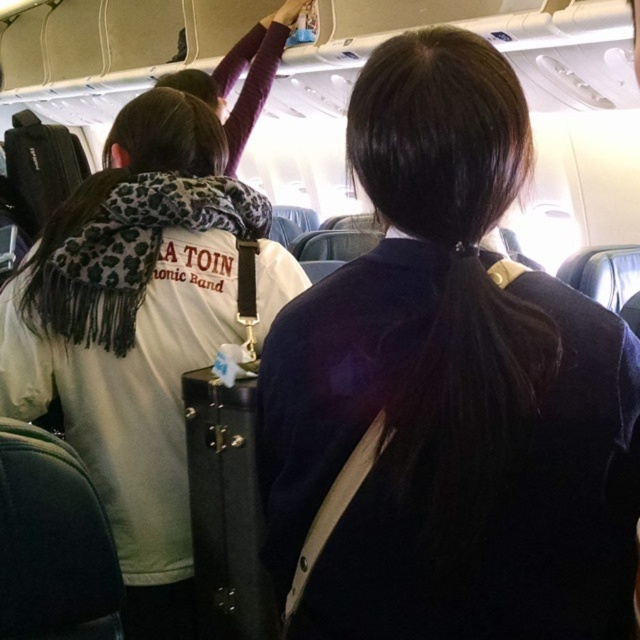
You are a flight attendant checking the seating area. You notice the dark blue fabric at center and the white fleece jacket at upper left. Which item is covering the other?

The dark blue fabric at center is positioned over white fleece jacket at upper left, so it is covering the jacket.

You are a flight attendant checking the overhead compartments. You notice the dark blue fabric at center and the white fleece jacket at upper left. Which item is closer to the floor?

The dark blue fabric at center has a lesser height compared to the white fleece jacket at upper left, so the dark blue fabric at center is closer to the floor.

You are sitting in an airplane cabin and notice two points marked in the scene. The first point is at coordinates point (612,360) and the second is at point (124,289). Which point is nearer to you?

Point (612,360) is closer to the viewer than point (124,289).